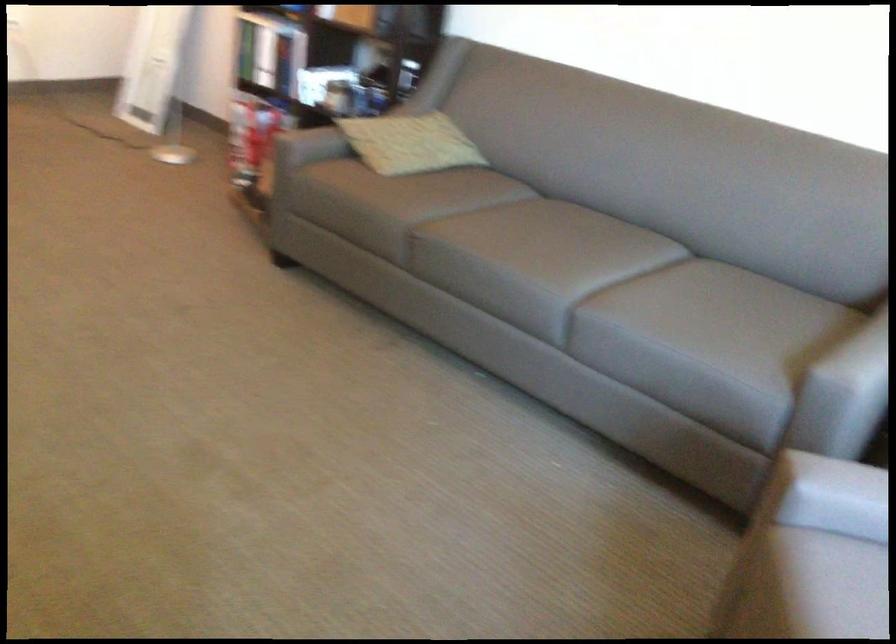
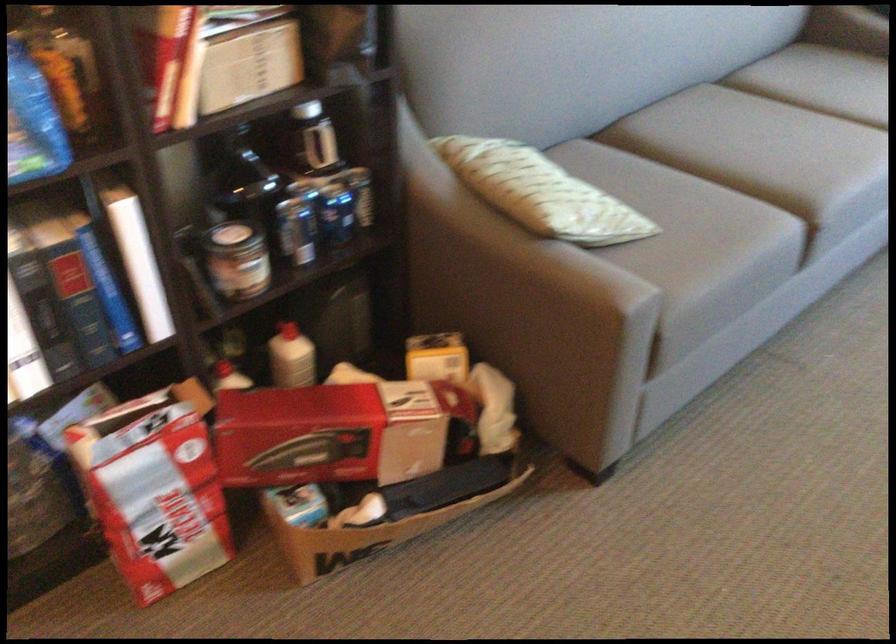
The point at (320, 82) is marked in the first image. Where is the corresponding point in the second image?

(297, 230)